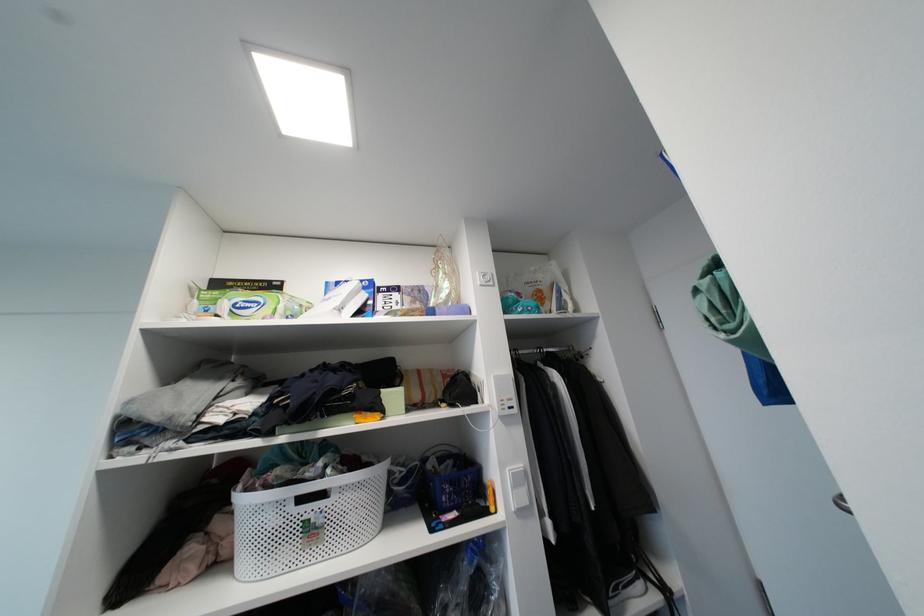
Where would you push the white light switch? Please return your answer as a coordinate pair (x, y).

(485, 278)